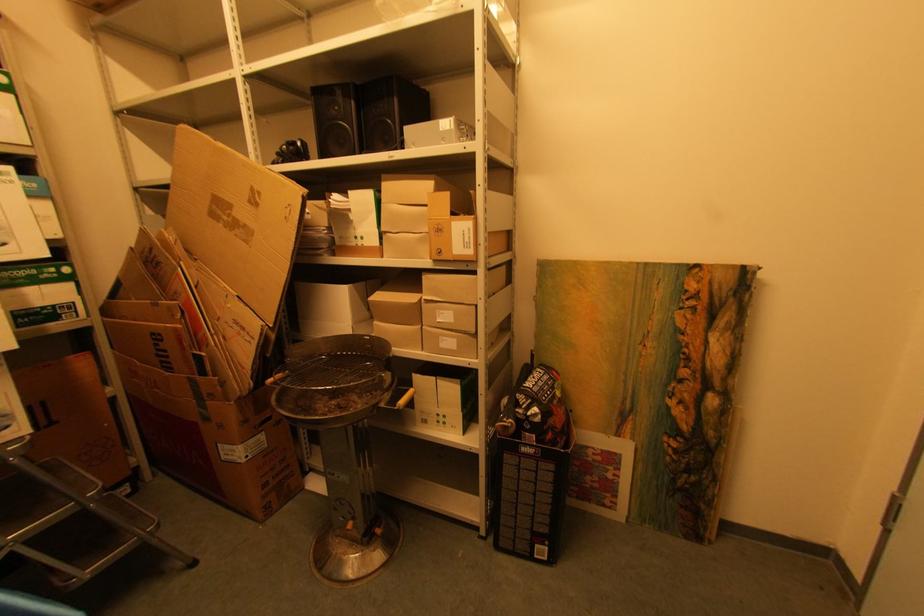
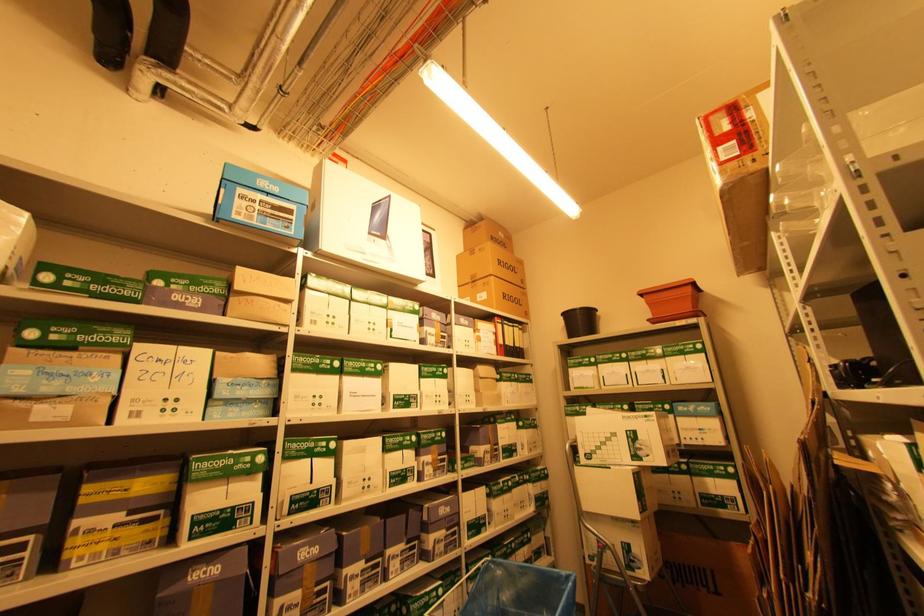
Question: The camera is either moving clockwise (left) or counter-clockwise (right) around the object. The first image is from the beginning of the video and the second image is from the end. Is the camera moving left or right when shooting the video?

Choices:
 (A) Left
 (B) Right

Answer: (B)